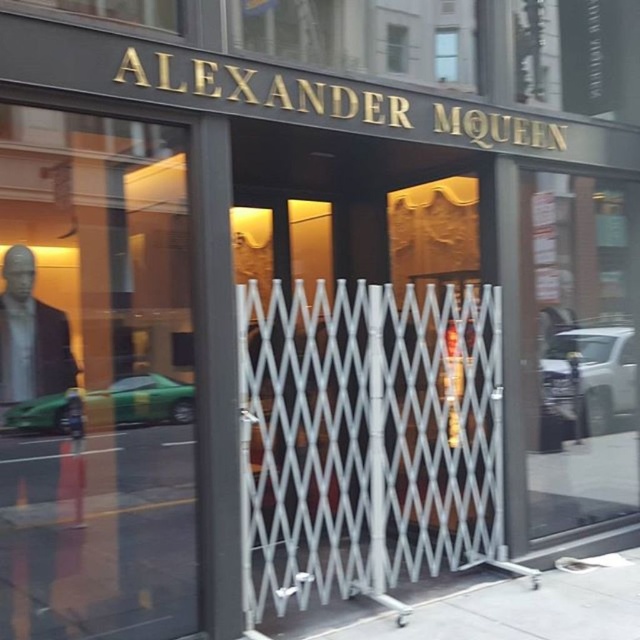
You are a delivery person trying to enter the Alexander McQueen boutique. You see the green glass mannequin at left and the transparent glass door at center. Which object is closer to the ground?

The green glass mannequin at left is closer to the ground because it is below the transparent glass door at center.

You are standing in front of the Alexander McQueen boutique and want to know how far you are from the point marked at coordinates (412,484) inside the store. Can you determine the distance?

The distance between you and the point marked at coordinates (412,484) is 4.27 meters.

You are a customer standing outside the store. You see the point at coordinates (93,380) on the green glass mannequin at left. Can you touch that point while the security gate is closed?

The point at coordinates (93,380) is on the green glass mannequin at left, which is inside the store. Since the security gate is closed, you cannot reach inside to touch that point.